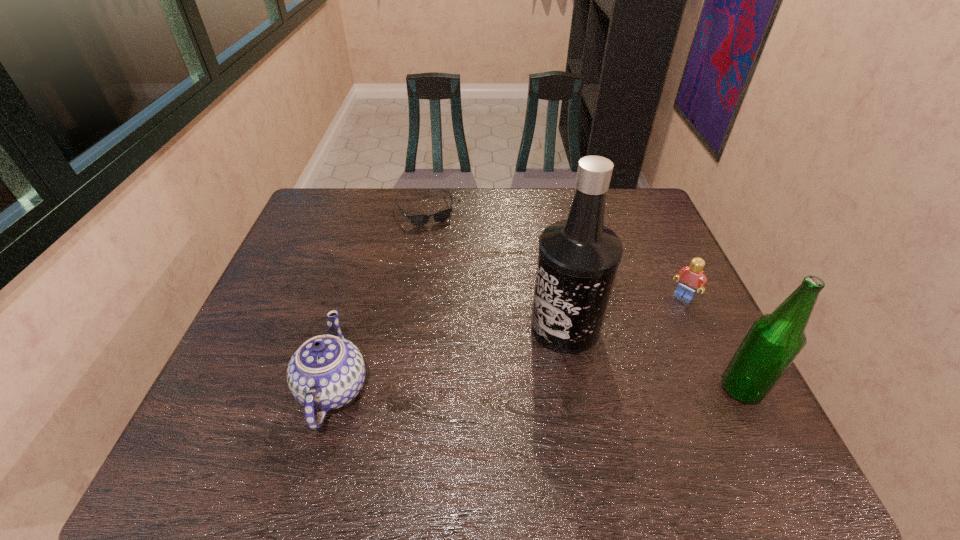
This screenshot has width=960, height=540. I want to click on vacant spot on the desktop that is between the chinaware and the beer bottle and is positioned on the front-facing side of the Lego, so click(x=598, y=389).

Where is `vacant spot on the desktop that is between the third tallest object and the second tallest object and is positioned on the front-facing side of the farthest object`? The image size is (960, 540). vacant spot on the desktop that is between the third tallest object and the second tallest object and is positioned on the front-facing side of the farthest object is located at coordinates (497, 389).

Where is `free space on the desktop that is between the chinaware and the beer bottle and is positioned on the front label of the tallest object`? Image resolution: width=960 pixels, height=540 pixels. free space on the desktop that is between the chinaware and the beer bottle and is positioned on the front label of the tallest object is located at coordinates click(515, 389).